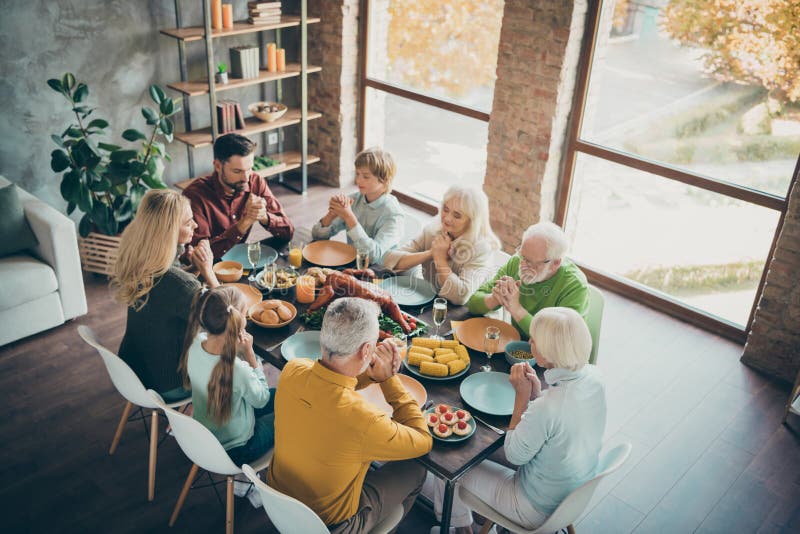
Where is `beige colored candles`? The image size is (800, 534). beige colored candles is located at coordinates (304, 290), (210, 15), (242, 15), (285, 62), (268, 54).